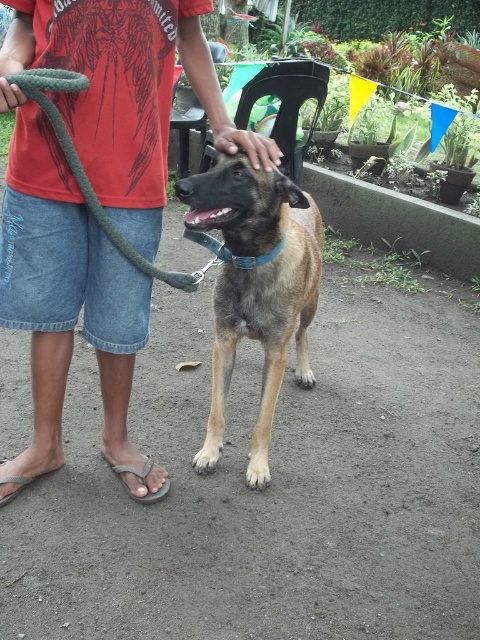
You are standing in the garden and see the brown fur dog at center and the gray rubber sandal at lower left. Which object is positioned more to the right side of the scene?

The brown fur dog at center is positioned more to the right side of the scene than the gray rubber sandal at lower left.

You are the person in the image holding the green rope leash at left and wearing the gray fabric sandal at lower left. If you look down at your feet, which object is higher up?

The green rope leash at left is above the gray fabric sandal at lower left, so when you look down, the green rope leash at left appears higher up than the gray fabric sandal at lower left.

You are standing in the garden and want to place a small potted plant between the two points labeled as point (123, 435) and point (263, 432). Which point should the plant be closer to if it needs to be nearer to the camera?

The small potted plant should be placed closer to point (123, 435) because it is closer to the camera than point (263, 432).